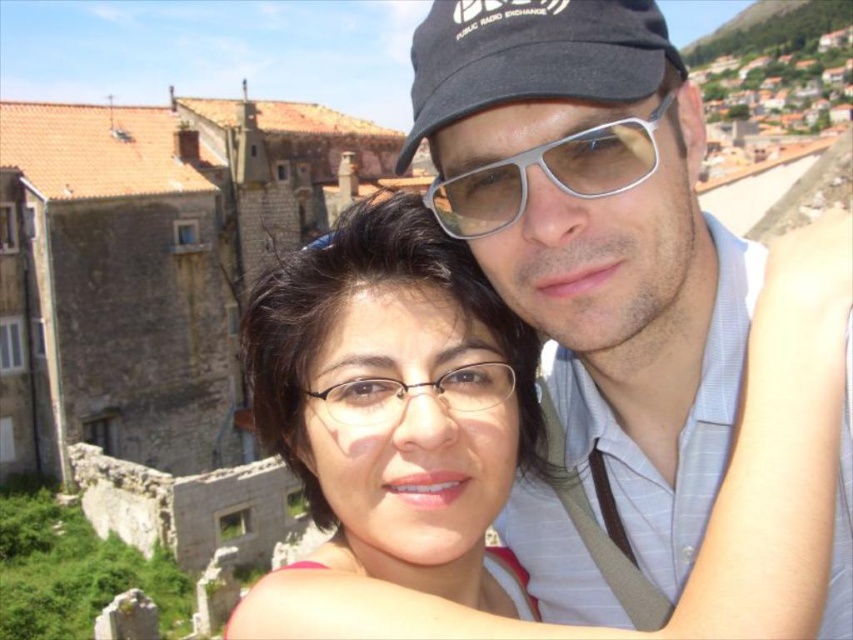
You are a photographer standing at the center of the scene. You want to take a photo that includes both the silver metallic goggles at center and the clear plastic glasses at center. Given that your camera has a maximum focus range of 7 meters, will you be able to capture both objects in focus at the same time?

The silver metallic goggles at center is 7.27 meters from clear plastic glasses at center. Since the distance between them exceeds the camera maximum focus range of 7 meters, you cannot capture both objects in focus simultaneously.

You are a photographer trying to capture a closeup shot of the silver metallic goggles at center and clear plastic glasses at center. Since both are at the center, which one will appear larger in your photo?

The silver metallic goggles at center is taller than clear plastic glasses at center, so it will appear larger in the photo.